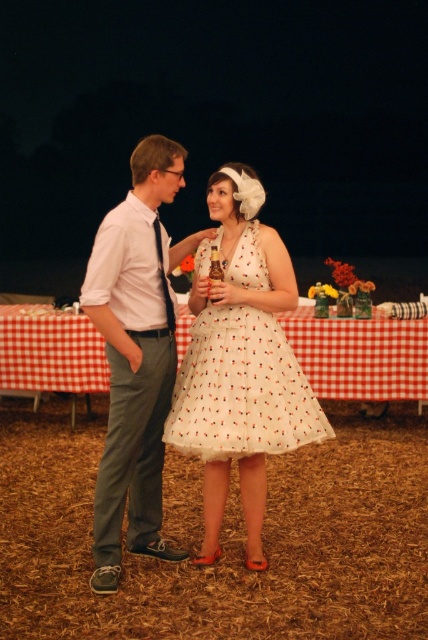
Looking at this image, you are a photographer at the event and need to capture a photo of both the white lace dress at center and the white checkered tablecloth at center. Which object should be positioned closer to the camera to ensure both are in focus?

The white lace dress at center is taller than the white checkered tablecloth at center, so positioning the white lace dress at center closer to the camera would help keep both in focus since it is taller and requires more depth of field.

You are a photographer at the event and want to capture both the light gray cotton pants at left and the white checkered tablecloth at center in a single frame. Which object should you focus on to ensure both are in the frame without cropping?

The light gray cotton pants at left has a lesser width compared to white checkered tablecloth at center, so focusing on the center of the white checkered tablecloth at center would allow both objects to fit within the frame.

You are standing at the origin point in the image. Which direction should you move to reach the light gray cotton pants at left?

The light gray cotton pants at left is located at point 0.556 on the x axis and 0.318 on the y axis. Since the origin is at the bottom left corner, moving right along the x axis and up along the y axis would reach the coordinates.